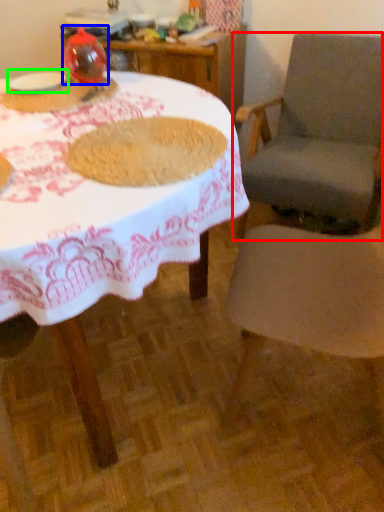
Question: Considering the real-world distances, which object is closest to chair (highlighted by a red box)? tableware (highlighted by a blue box) or tableware (highlighted by a green box).

Choices:
 (A) tableware
 (B) tableware

Answer: (A)